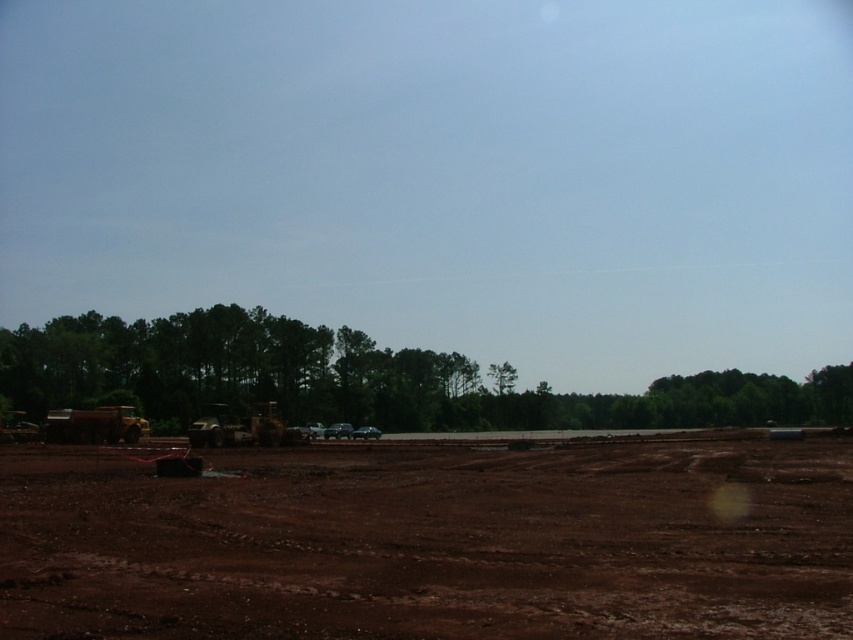
You are standing at the edge of the construction site and see the green leafy trees at center and the green leafy tree at center. Which one is positioned to the right?

The green leafy trees at center is positioned to the right of the green leafy tree at center.

You are a construction worker standing on the brown dirt field at center. You look towards the green leafy tree at center. Which object is taller?

The green leafy tree at center is taller than the brown dirt field at center.

You are a construction worker who needs to transport materials across the open area. The brown dirt field at center and the green leafy trees at center are in your path. Which part of the path is narrower?

The brown dirt field at center is narrower than the green leafy trees at center because its width is less than the latter.